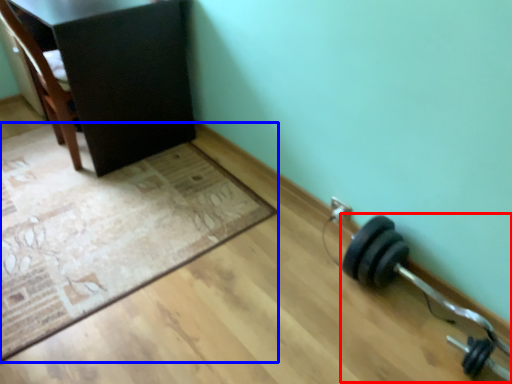
Question: Which object appears farthest to the camera in this image, dumbbell (highlighted by a red box) or mat (highlighted by a blue box)?

Choices:
 (A) dumbbell
 (B) mat

Answer: (B)